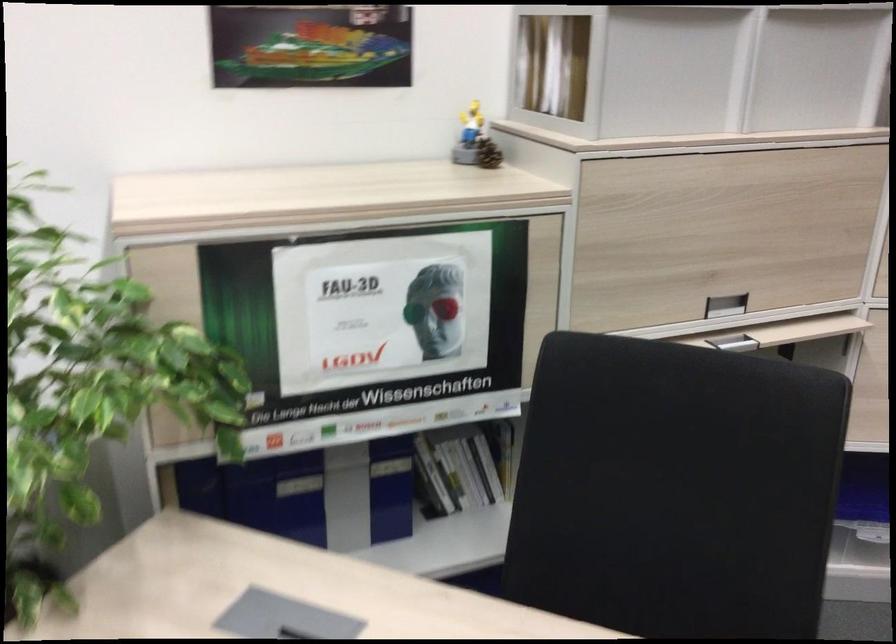
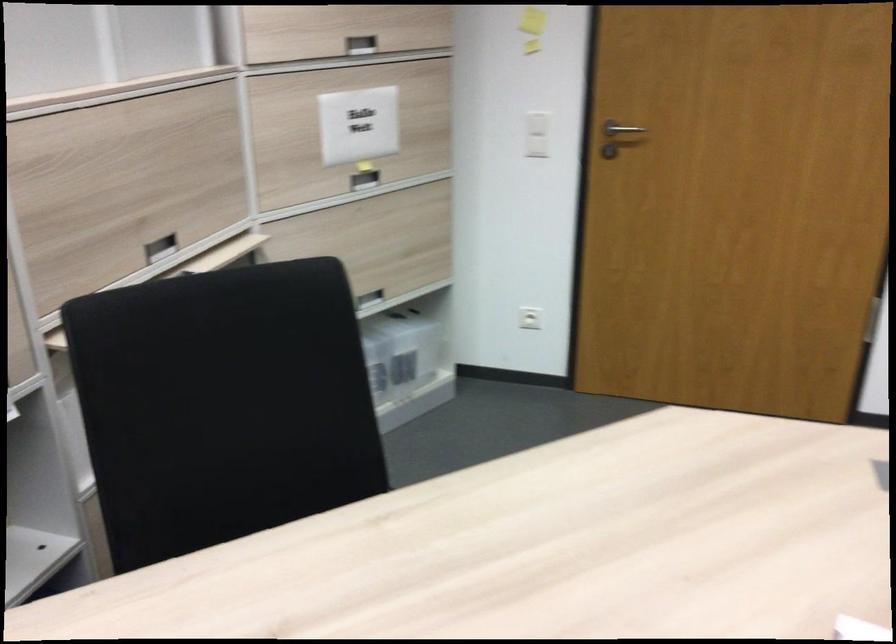
Where in the second image is the point corresponding to (x=719, y=299) from the first image?

(159, 247)